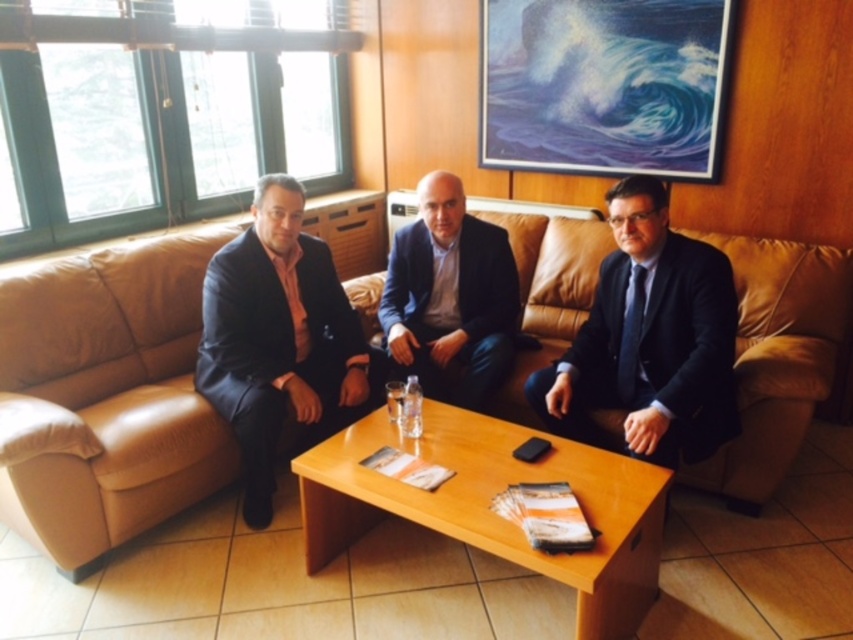
You are an interior designer planning to place a new rectangular coffee table between the leather couch at center and the wooden at center. The coffee table is 1.2 meters wide. Can the coffee table fit between them without overlapping either furniture?

The leather couch at center has a lesser width compared to wooden at center. Since the coffee table is 1.2 meters wide, it depends on the distance between the two furniture pieces. However, the provided information only states the relative widths of the couch and wooden item, not the space between them. Therefore, it is impossible to determine if the coffee table will fit without additional measurements.